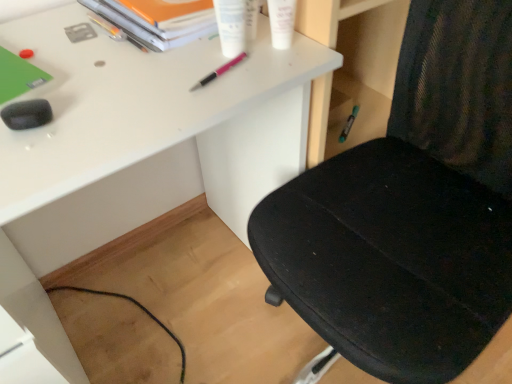
Where is `free space between white matte tube at upper center, which is counted as the second stationery, starting from the front, and matte black earbuds at left, the 1th stationery in the front-to-back sequence`? The width and height of the screenshot is (512, 384). free space between white matte tube at upper center, which is counted as the second stationery, starting from the front, and matte black earbuds at left, the 1th stationery in the front-to-back sequence is located at coordinates (147, 82).